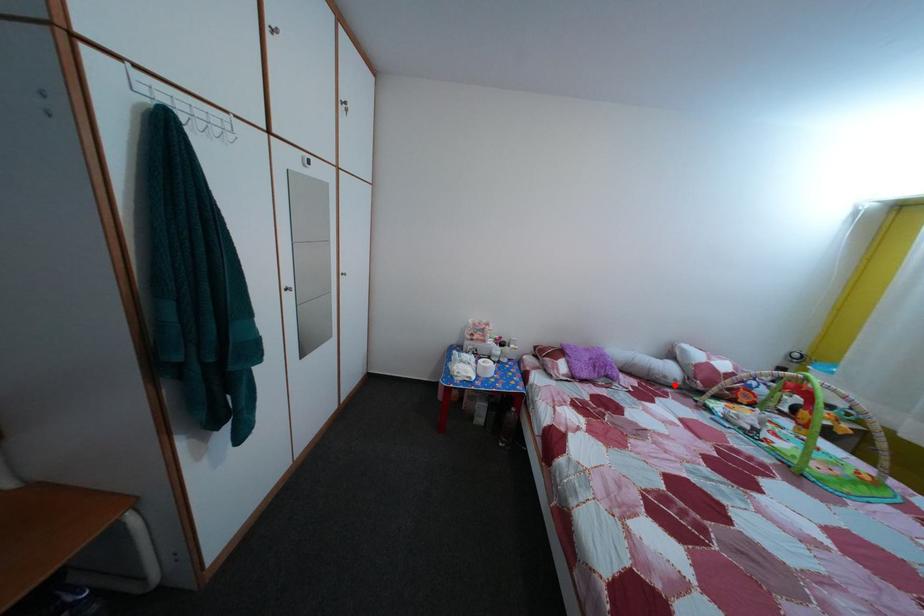
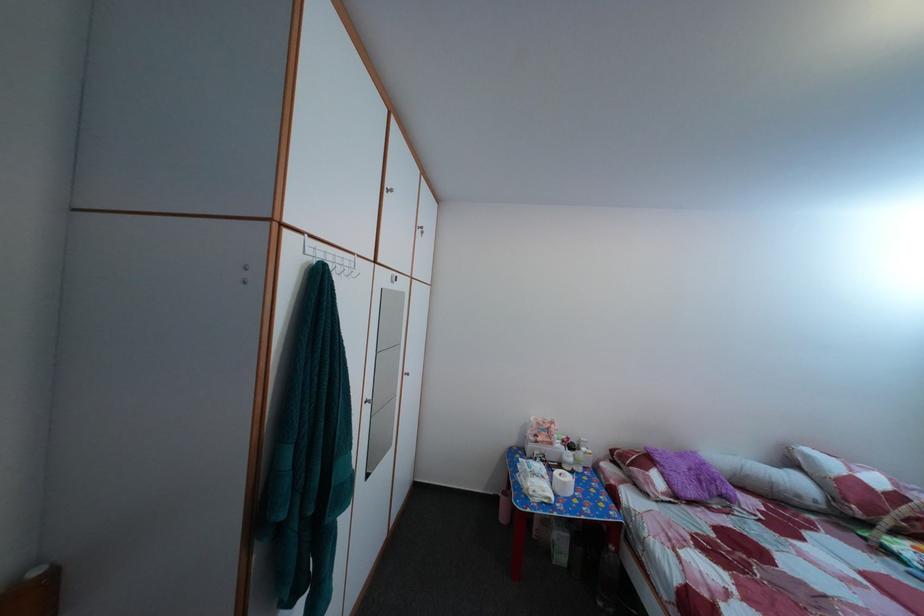
The point at the highlighted location is marked in the first image. Where is the corresponding point in the second image?

(808, 504)